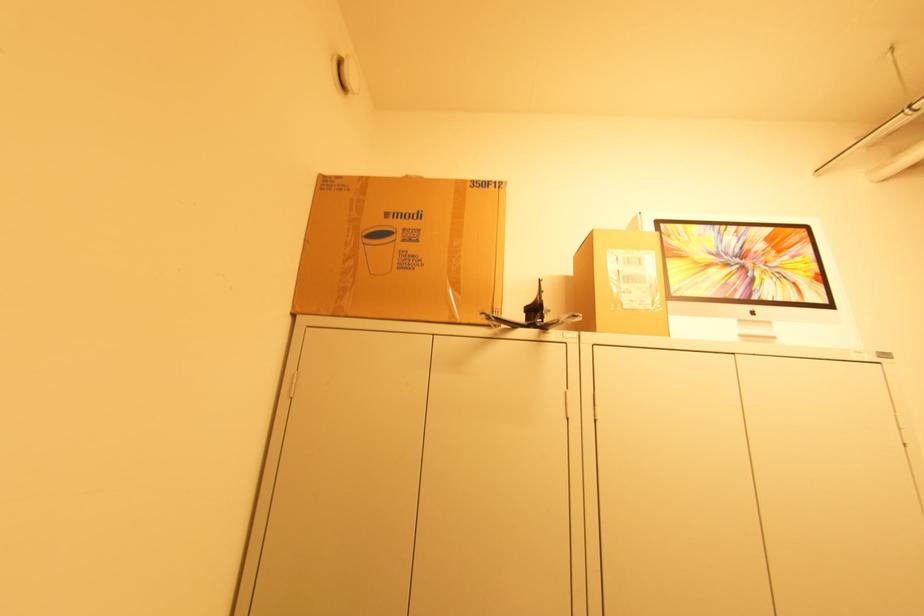
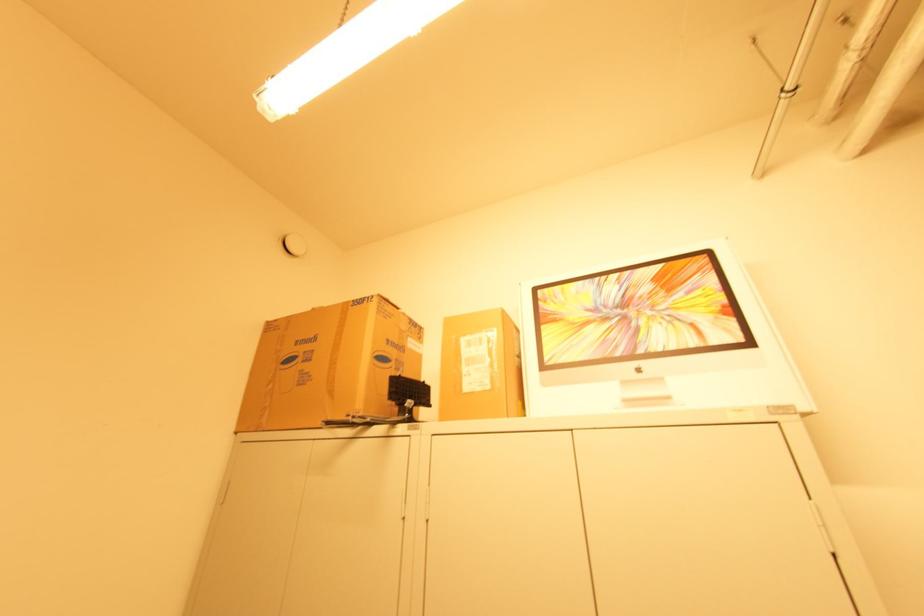
In the second image, find the point that corresponds to [408,177] in the first image.

(315, 309)